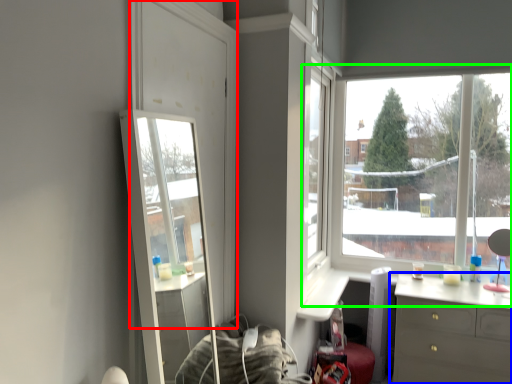
Question: Which object is the closest to the glass door (highlighted by a red box)? Choose among these: chest of drawers (highlighted by a blue box) or window (highlighted by a green box).

Choices:
 (A) chest of drawers
 (B) window

Answer: (A)